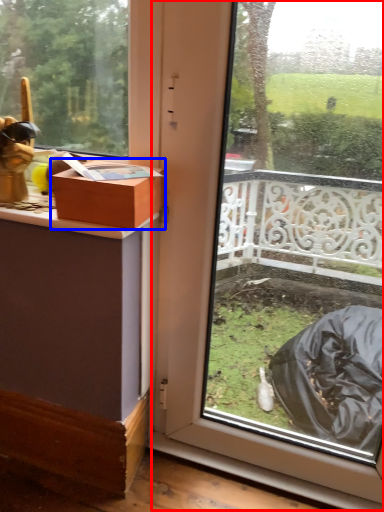
Question: Which of the following is the farthest to the observer, glass door (highlighted by a red box) or box (highlighted by a blue box)?

Choices:
 (A) glass door
 (B) box

Answer: (B)